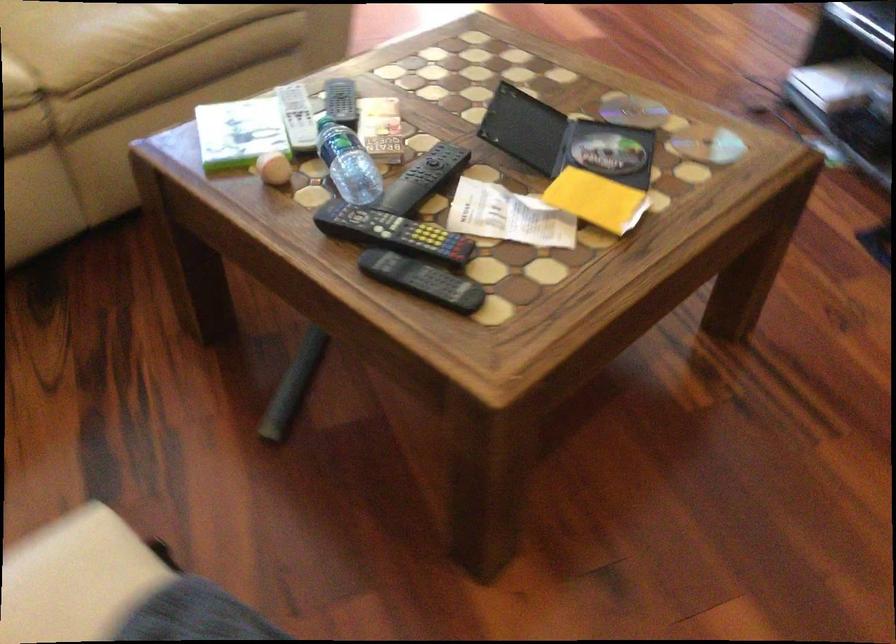
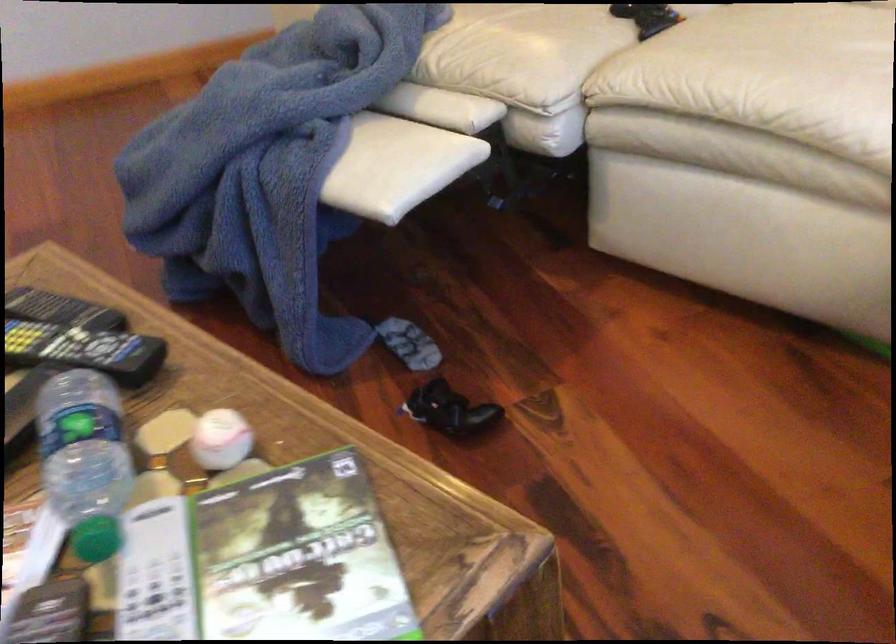
Find the pixel in the second image that matches (254,120) in the first image.

(298, 556)